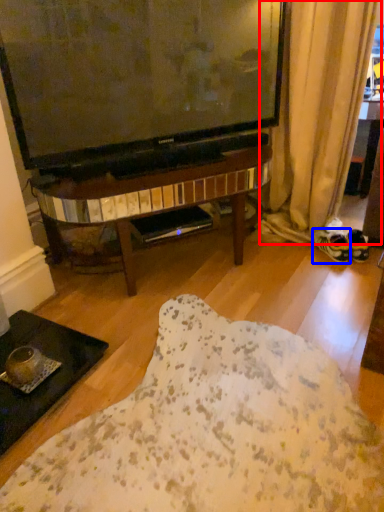
Question: Which of the following is the closest to the observer, curtain (highlighted by a red box) or footwear (highlighted by a blue box)?

Choices:
 (A) curtain
 (B) footwear

Answer: (A)